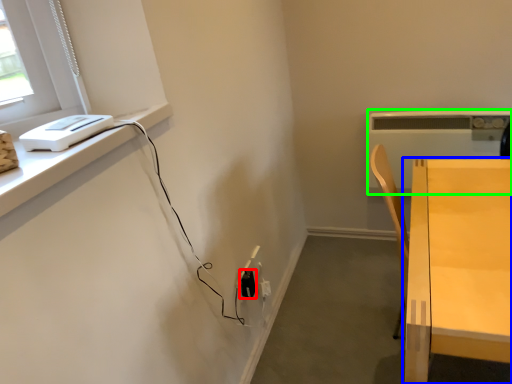
Question: Based on their relative distances, which object is nearer to electric outlet (highlighted by a red box)? Choose from table (highlighted by a blue box) and appliance (highlighted by a green box).

Choices:
 (A) table
 (B) appliance

Answer: (A)